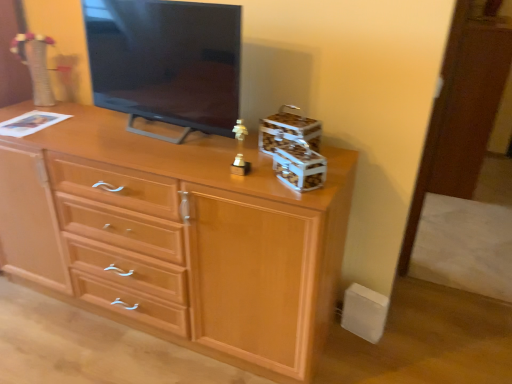
Find the location of a particular element. The height and width of the screenshot is (384, 512). free location to the left of metallic silver storage box at center-right, marked as the second storage box in a back-to-front arrangement is located at coordinates (253, 180).